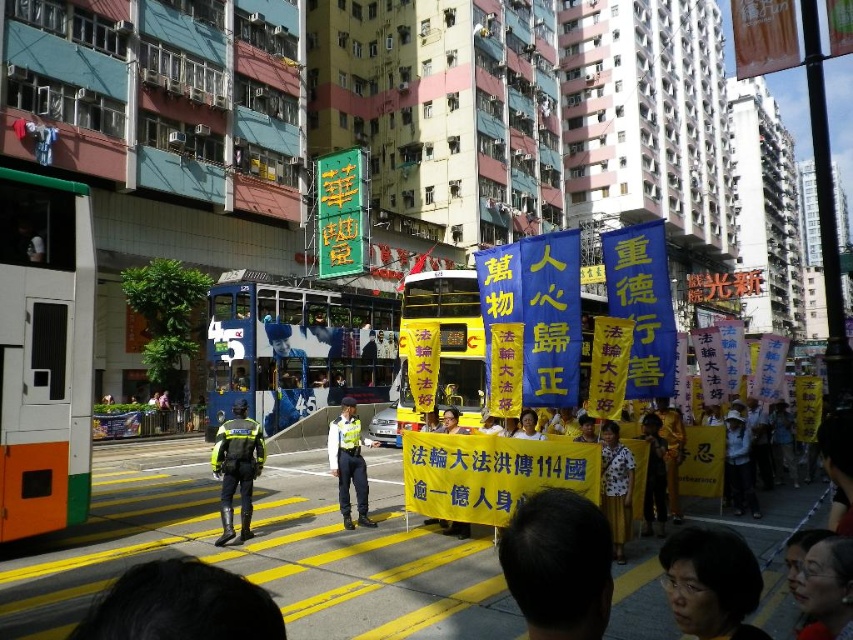
You are a photographer standing on the street and want to take a photo of the black hair at center without the orange and white bus at left blocking the view. Can you move to the right or left to achieve this?

The black hair at center is behind the orange and white bus at left, so moving to the right or left might not help because the bus is blocking the view. You might need to move forward or backward instead.

You are a pedestrian standing at the crosswalk in the scene. You see the blue painted decker bus at center and the white uniform at center. If you want to cross the street safely, which object should you pay more attention to and why?

You should pay more attention to the blue painted decker bus at center because it is farther away from you than the white uniform at center by 10.36 meters, so it may require more time to react to its movements.

You are a photographer standing at the crosswalk in the midground. You want to take a photo of both the group holding the yellow banners in the foreground and the police officers. However, you can only focus on one point at a time. Which point should you focus on to ensure both the group and the police officers are in focus? Choose between point A at coordinates point (15, 170) and point B at coordinates point (601, 557).

You should focus on point A at coordinates point (15, 170) because it is closer to the camera than point B at coordinates point (601, 557). Focusing on the closer point will keep both the foreground and midground subjects in focus.